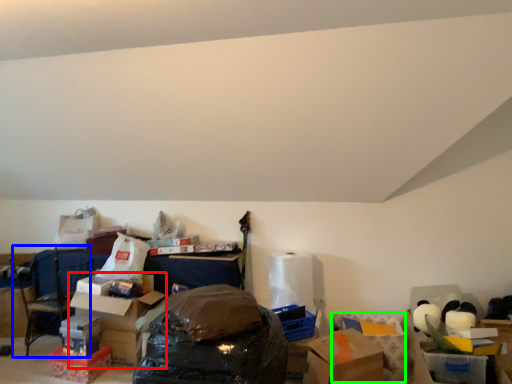
Question: Estimate the real-world distances between objects in this image. Which object is closer to cardboard box (highlighted by a red box), armchair (highlighted by a blue box) or cardboard box (highlighted by a green box)?

Choices:
 (A) armchair
 (B) cardboard box

Answer: (A)